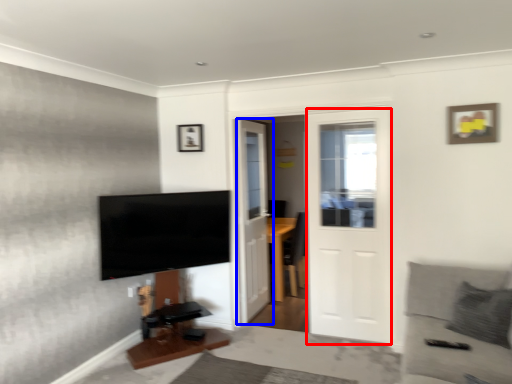
Question: Which object appears farthest to the camera in this image, door (highlighted by a red box) or door (highlighted by a blue box)?

Choices:
 (A) door
 (B) door

Answer: (B)